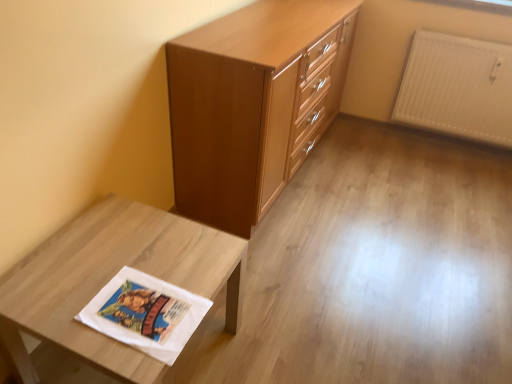
Where is `vacant area located to the right-hand side of white matte fabric at lower left`? This screenshot has height=384, width=512. vacant area located to the right-hand side of white matte fabric at lower left is located at coordinates (285, 328).